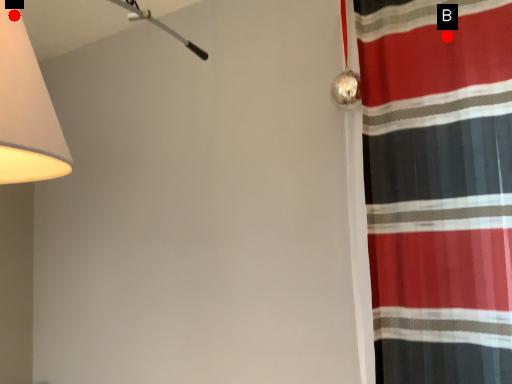
Question: Two points are circled on the image, labeled by A and B beside each circle. Which of the following is the farthest from the observer?

Choices:
 (A) A is further
 (B) B is further

Answer: (B)